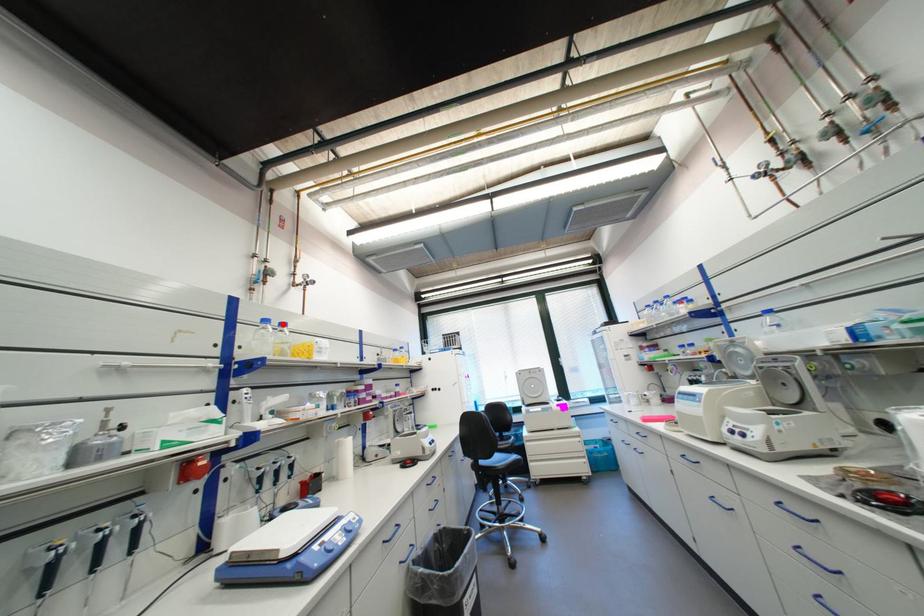
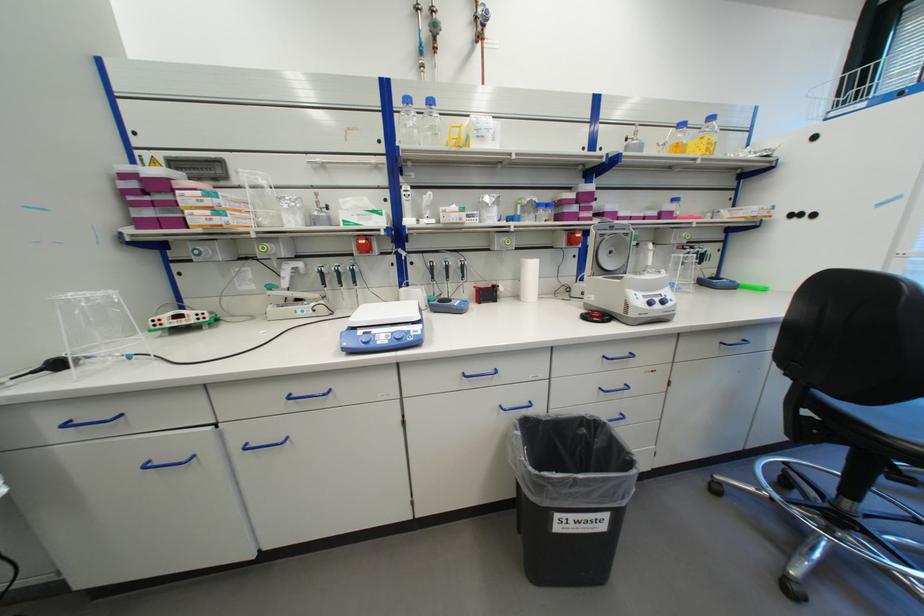
Question: A red point is marked in image1. In image2, is the corresponding 3D point closer to the camera or farther? Reply with the corresponding letter.

Choices:
 (A) The corresponding 3D point is closer.
 (B) The corresponding 3D point is farther.

Answer: (A)